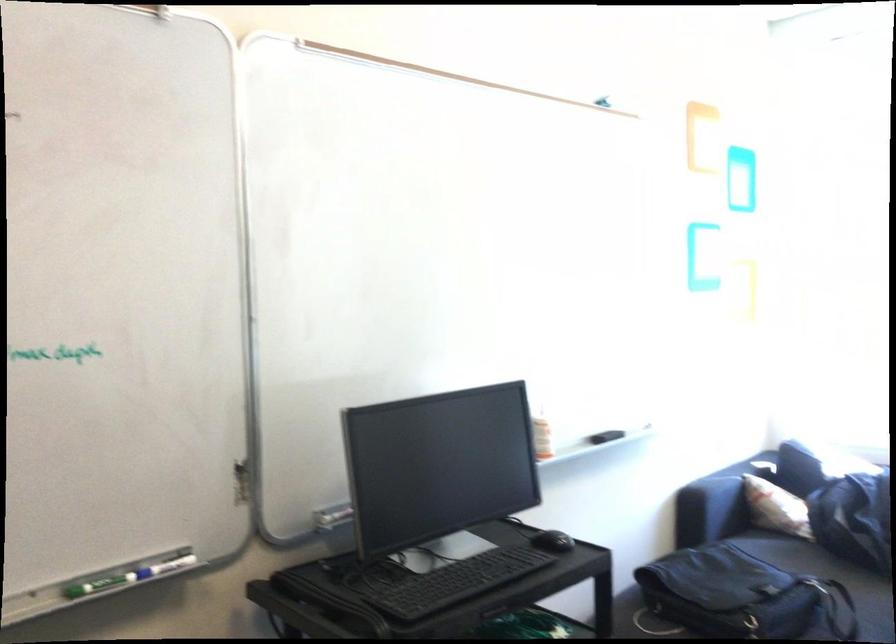
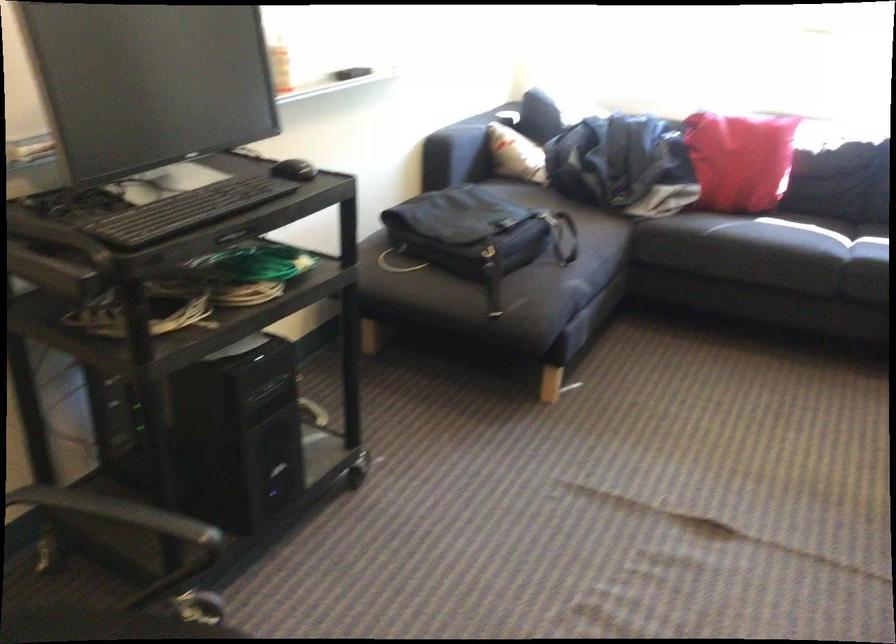
The images are taken continuously from a first-person perspective. In which direction is your viewpoint rotating?

The rotation direction of the camera is right-down.